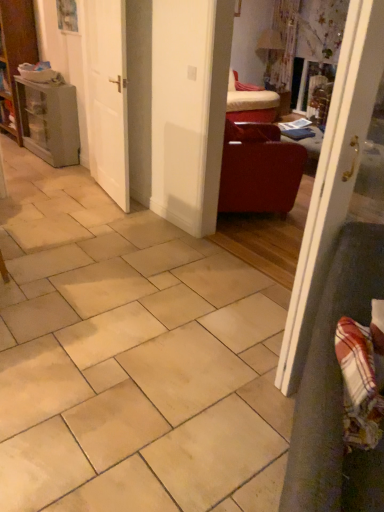
Question: Is white glossy door at right, placed as the 1th door when sorted from right to left, oriented towards matte leather armchair at center-right?

Choices:
 (A) yes
 (B) no

Answer: (B)

Question: Considering the relative positions of white glossy door at right, placed as the first door when sorted from front to back, and matte leather armchair at center-right in the image provided, is white glossy door at right, placed as the first door when sorted from front to back, to the left of matte leather armchair at center-right from the viewer's perspective?

Choices:
 (A) no
 (B) yes

Answer: (A)

Question: From the image's perspective, is white glossy door at right, placed as the 1th door when sorted from right to left, below matte leather armchair at center-right?

Choices:
 (A) yes
 (B) no

Answer: (A)

Question: Is white glossy door at right, which ranks as the second door in back-to-front order, facing away from matte leather armchair at center-right?

Choices:
 (A) yes
 (B) no

Answer: (B)

Question: Does white glossy door at right, acting as the second door starting from the left, have a lesser width compared to matte leather armchair at center-right?

Choices:
 (A) no
 (B) yes

Answer: (B)

Question: From a real-world perspective, relative to matte gray cabinet at left, is plaid fabric armchair at lower right vertically above or below?

Choices:
 (A) above
 (B) below

Answer: (A)

Question: Is point (337, 400) positioned closer to the camera than point (64, 84)?

Choices:
 (A) closer
 (B) farther

Answer: (A)

Question: Based on their sizes in the image, would you say plaid fabric armchair at lower right is bigger or smaller than matte gray cabinet at left?

Choices:
 (A) big
 (B) small

Answer: (A)

Question: Based on their positions, is plaid fabric armchair at lower right located to the left or right of matte gray cabinet at left?

Choices:
 (A) left
 (B) right

Answer: (B)

Question: In terms of height, does white glossy door at right, which ranks as the second door in back-to-front order, look taller or shorter compared to plaid fabric armchair at lower right?

Choices:
 (A) short
 (B) tall

Answer: (B)

Question: From a real-world perspective, relative to plaid fabric armchair at lower right, is white glossy door at right, acting as the second door starting from the left, vertically above or below?

Choices:
 (A) below
 (B) above

Answer: (B)

Question: Is white glossy door at right, acting as the second door starting from the left, to the left or to the right of plaid fabric armchair at lower right in the image?

Choices:
 (A) right
 (B) left

Answer: (A)

Question: Is point (352, 151) positioned closer to the camera than point (336, 306)?

Choices:
 (A) farther
 (B) closer

Answer: (B)

Question: Is plaid fabric armchair at lower right situated inside matte leather armchair at center-right or outside?

Choices:
 (A) inside
 (B) outside

Answer: (B)

Question: Looking at the image, does plaid fabric armchair at lower right seem bigger or smaller compared to matte leather armchair at center-right?

Choices:
 (A) small
 (B) big

Answer: (B)